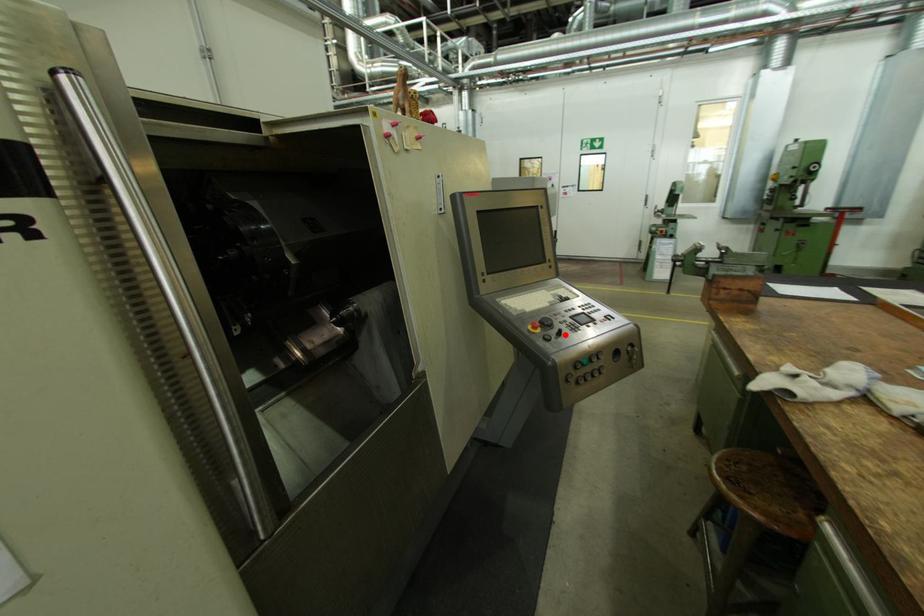
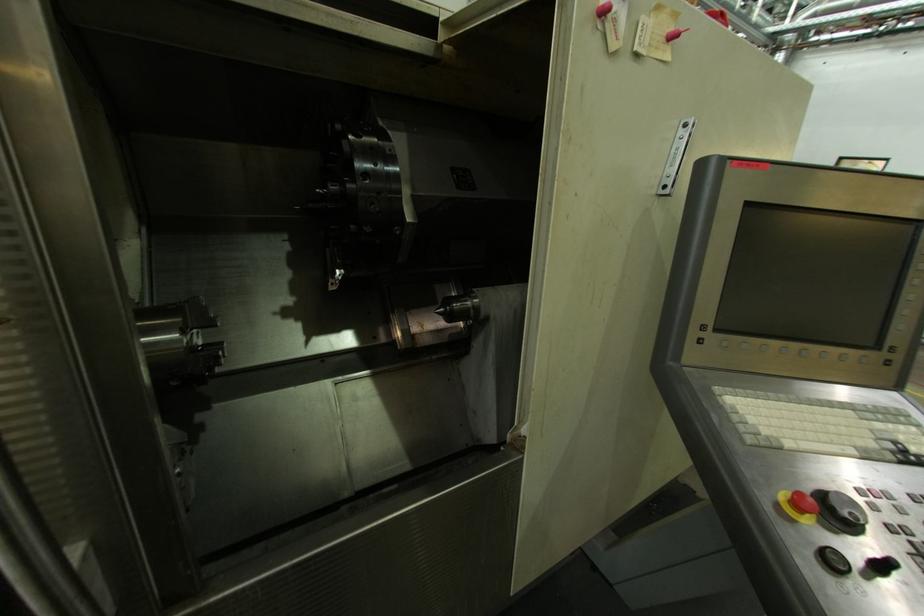
In the second image, find the point that corresponds to the highlighted location in the first image.

(888, 569)